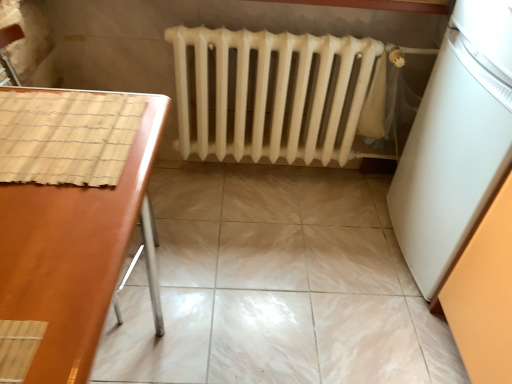
Question: Does marble tile floor at center lie in front of white matte refrigerator at right?

Choices:
 (A) yes
 (B) no

Answer: (B)

Question: Is marble tile floor at center positioned behind white matte refrigerator at right?

Choices:
 (A) yes
 (B) no

Answer: (A)

Question: Can you confirm if marble tile floor at center is taller than white matte refrigerator at right?

Choices:
 (A) yes
 (B) no

Answer: (B)

Question: Is marble tile floor at center directly adjacent to white matte refrigerator at right?

Choices:
 (A) no
 (B) yes

Answer: (A)

Question: From the image's perspective, is marble tile floor at center below white matte refrigerator at right?

Choices:
 (A) no
 (B) yes

Answer: (B)

Question: Considering the relative positions of brown glossy table at left and white matte radiator at center in the image provided, is brown glossy table at left to the left or to the right of white matte radiator at center?

Choices:
 (A) right
 (B) left

Answer: (B)

Question: From the image's perspective, is brown glossy table at left positioned above or below white matte radiator at center?

Choices:
 (A) below
 (B) above

Answer: (A)

Question: Is brown glossy table at left inside the boundaries of white matte radiator at center, or outside?

Choices:
 (A) inside
 (B) outside

Answer: (B)

Question: Is brown glossy table at left in front of or behind white matte radiator at center in the image?

Choices:
 (A) front
 (B) behind

Answer: (A)

Question: Considering the positions of marble tile floor at center and white matte radiator at center in the image, is marble tile floor at center bigger or smaller than white matte radiator at center?

Choices:
 (A) small
 (B) big

Answer: (A)

Question: Would you say marble tile floor at center is to the left or to the right of white matte radiator at center in the picture?

Choices:
 (A) right
 (B) left

Answer: (B)

Question: From a real-world perspective, is marble tile floor at center physically located above or below white matte radiator at center?

Choices:
 (A) above
 (B) below

Answer: (B)

Question: From their relative heights in the image, would you say marble tile floor at center is taller or shorter than white matte radiator at center?

Choices:
 (A) short
 (B) tall

Answer: (A)

Question: From the image's perspective, is brown glossy table at left positioned above or below white matte refrigerator at right?

Choices:
 (A) above
 (B) below

Answer: (B)

Question: Would you say brown glossy table at left is to the left or to the right of white matte refrigerator at right in the picture?

Choices:
 (A) right
 (B) left

Answer: (B)